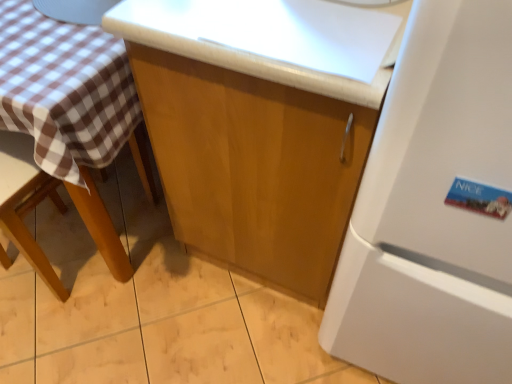
This screenshot has height=384, width=512. Identify the location of brown wooden chair at left. (26, 202).

You are a GUI agent. You are given a task and a screenshot of the screen. Output one action in this format:
    pyautogui.click(x=<x>, y=<y>)
    Task: Click on the glossy wood cabinet at center
    The image size is (512, 384).
    Given the screenshot: What is the action you would take?
    pyautogui.click(x=259, y=123)

What do you see at coordinates (259, 123) in the screenshot? I see `glossy wood cabinet at center` at bounding box center [259, 123].

Find the location of a particular element. white matte refrigerator at right is located at coordinates (434, 209).

From the picture: Is brown wooden chair at left completely or partially outside of glossy wood cabinet at center?

Yes.

Is brown wooden chair at left thinner than glossy wood cabinet at center?

Yes.

Consider the image. Are brown wooden chair at left and glossy wood cabinet at center making contact?

No, brown wooden chair at left is not next to glossy wood cabinet at center.

Is point (6, 195) positioned in front of point (181, 14)?

No, it is behind (181, 14).

Is glossy wood cabinet at center inside or outside of brown wooden chair at left?

The correct answer is: outside.

Is glossy wood cabinet at center oriented towards brown wooden chair at left?

No, glossy wood cabinet at center is not facing towards brown wooden chair at left.

Between point (168, 175) and point (11, 141), which one is positioned in front?

The point (168, 175) is closer to the camera.

Would you consider white matte refrigerator at right to be distant from glossy wood cabinet at center?

white matte refrigerator at right is near glossy wood cabinet at center, not far away.

In the scene shown: From a real-world perspective, does white matte refrigerator at right stand above glossy wood cabinet at center?

Yes, from a real-world perspective, white matte refrigerator at right is over glossy wood cabinet at center

Considering the relative sizes of white matte refrigerator at right and glossy wood cabinet at center in the image provided, is white matte refrigerator at right taller than glossy wood cabinet at center?

Yes.

Find the location of a particular element. The height and width of the screenshot is (384, 512). cabinetry located behind the white matte refrigerator at right is located at coordinates (259, 123).

Is brown wooden chair at left with white matte refrigerator at right?

No, brown wooden chair at left is not touching white matte refrigerator at right.

The height and width of the screenshot is (384, 512). Identify the location of refrigerator located on the right of brown wooden chair at left. (434, 209).

Is brown wooden chair at left inside or outside of white matte refrigerator at right?

brown wooden chair at left cannot be found inside white matte refrigerator at right.

Which is farther, (x=89, y=181) or (x=511, y=367)?

Positioned behind is point (x=89, y=181).

Who is taller, white matte refrigerator at right or brown wooden chair at left?

With more height is white matte refrigerator at right.

From the image's perspective, which is above, white matte refrigerator at right or brown wooden chair at left?

white matte refrigerator at right is shown above in the image.

Can you tell me how much white matte refrigerator at right and brown wooden chair at left differ in facing direction?

0.632 degrees separate the facing orientations of white matte refrigerator at right and brown wooden chair at left.

Does white matte refrigerator at right turn towards brown wooden chair at left?

No, white matte refrigerator at right does not turn towards brown wooden chair at left.

Is glossy wood cabinet at center taller than white matte refrigerator at right?

No.

Between glossy wood cabinet at center and white matte refrigerator at right, which one is positioned behind?

glossy wood cabinet at center is more distant.

From the image's perspective, who appears lower, glossy wood cabinet at center or white matte refrigerator at right?

white matte refrigerator at right.

Looking at their sizes, would you say glossy wood cabinet at center is wider or thinner than white matte refrigerator at right?

In the image, glossy wood cabinet at center appears to be more narrow than white matte refrigerator at right.

This screenshot has height=384, width=512. In the image, there is a glossy wood cabinet at center. Find the location of `chair below it (from the image's perspective)`. chair below it (from the image's perspective) is located at coordinates (26, 202).

In the image, there is a brown wooden chair at left. Where is `cabinetry above it (from the image's perspective)`? cabinetry above it (from the image's perspective) is located at coordinates (259, 123).

From the image, which object appears to be farther from glossy wood cabinet at center, brown wooden chair at left or white matte refrigerator at right?

Based on the image, brown wooden chair at left appears to be further to glossy wood cabinet at center.

In the scene shown: Based on their spatial positions, is glossy wood cabinet at center or white matte refrigerator at right closer to brown wooden chair at left?

glossy wood cabinet at center.

Considering their positions, is glossy wood cabinet at center positioned closer to white matte refrigerator at right than brown wooden chair at left?

Based on the image, glossy wood cabinet at center appears to be nearer to white matte refrigerator at right.

Estimate the real-world distances between objects in this image. Which object is closer to glossy wood cabinet at center, white matte refrigerator at right or brown wooden chair at left?

white matte refrigerator at right.

From the image, which object appears to be nearer to white matte refrigerator at right, brown wooden chair at left or glossy wood cabinet at center?

The object closer to white matte refrigerator at right is glossy wood cabinet at center.

Looking at the image, which one is located closer to brown wooden chair at left, white matte refrigerator at right or glossy wood cabinet at center?

glossy wood cabinet at center is closer to brown wooden chair at left.

At what (x,y) coordinates should I click in order to perform the action: click on cabinetry situated between brown wooden chair at left and white matte refrigerator at right from left to right. Please return your answer as a coordinate pair (x, y). Looking at the image, I should click on (259, 123).